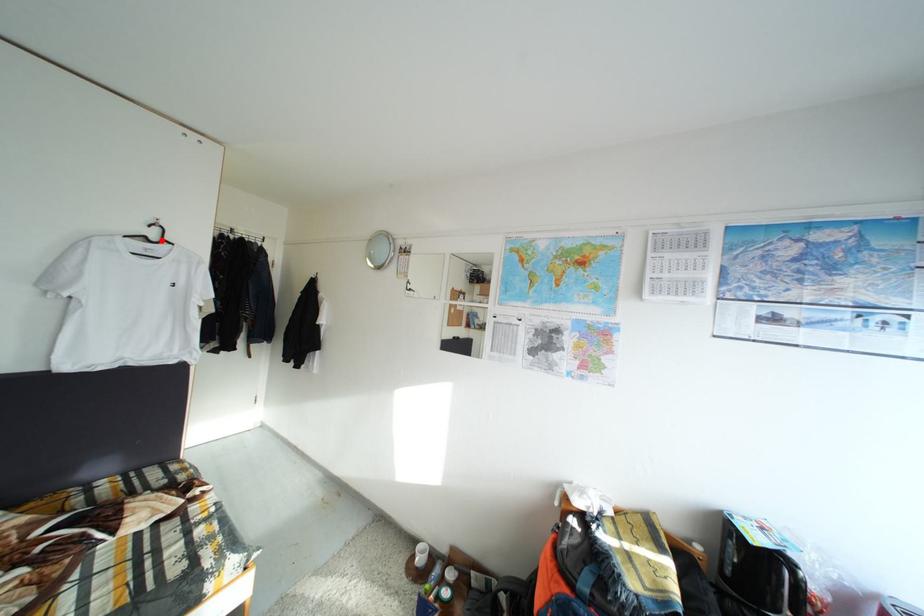
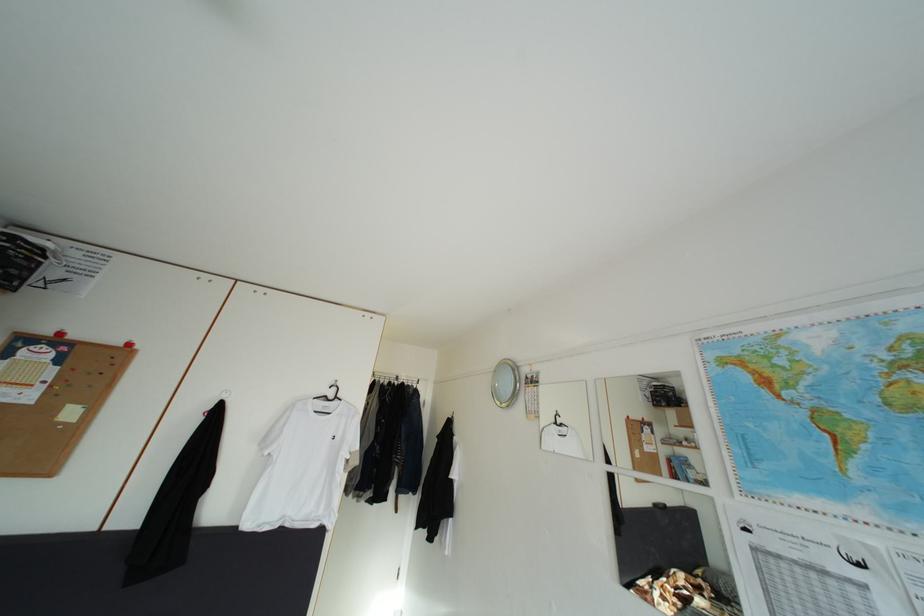
Question: I am providing you with two images of the same scene from different viewpoints. Image1 has a red point marked. In image2, the corresponding 3D location appears at what relative position? Reply with the corresponding letter.

Choices:
 (A) Closer
 (B) Farther

Answer: (B)